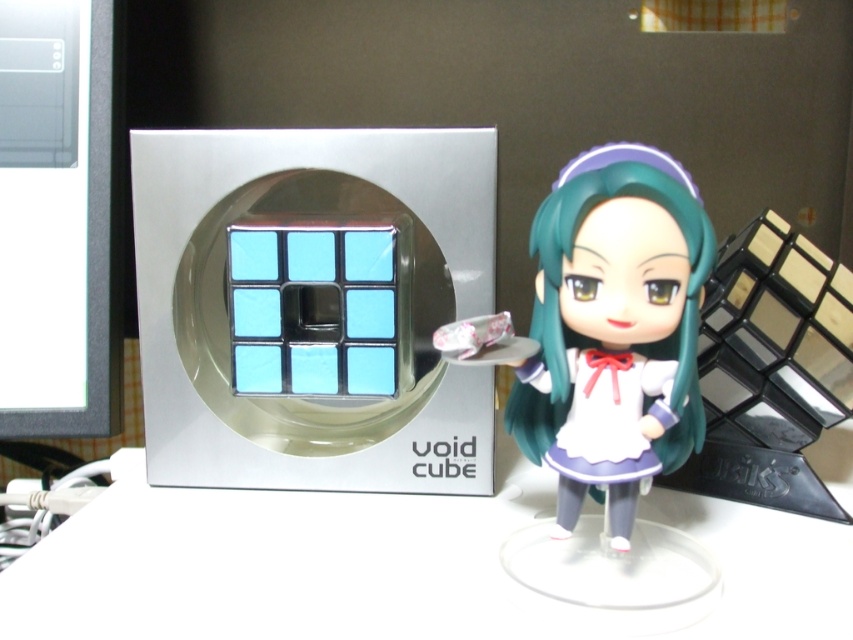
The width and height of the screenshot is (853, 640). What do you see at coordinates (393, 566) in the screenshot?
I see `white glossy table at center` at bounding box center [393, 566].

Where is `white glossy table at center`? The image size is (853, 640). white glossy table at center is located at coordinates (393, 566).

The height and width of the screenshot is (640, 853). In order to click on white glossy table at center in this screenshot , I will do `click(393, 566)`.